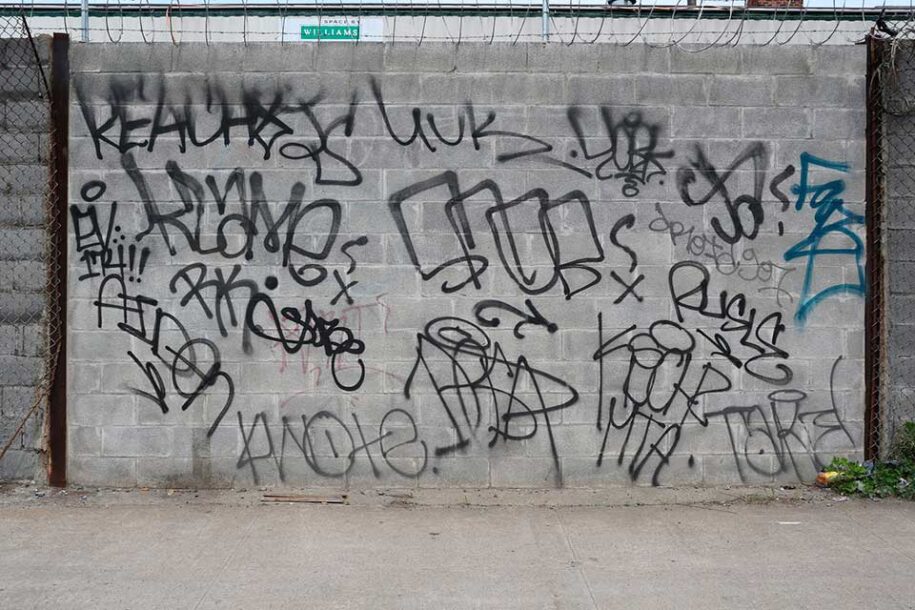
What are the coordinates of `wall` in the screenshot? It's located at (393, 281).